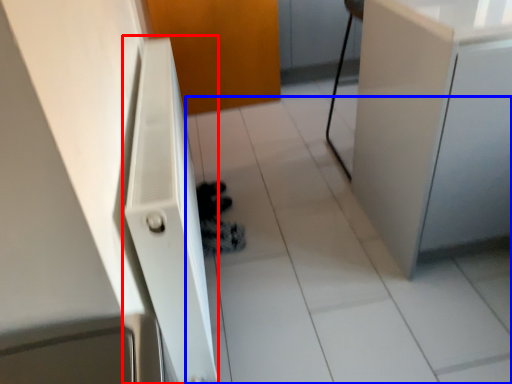
Question: Which of the following is the closest to the observer, radiator (highlighted by a red box) or tile (highlighted by a blue box)?

Choices:
 (A) radiator
 (B) tile

Answer: (A)